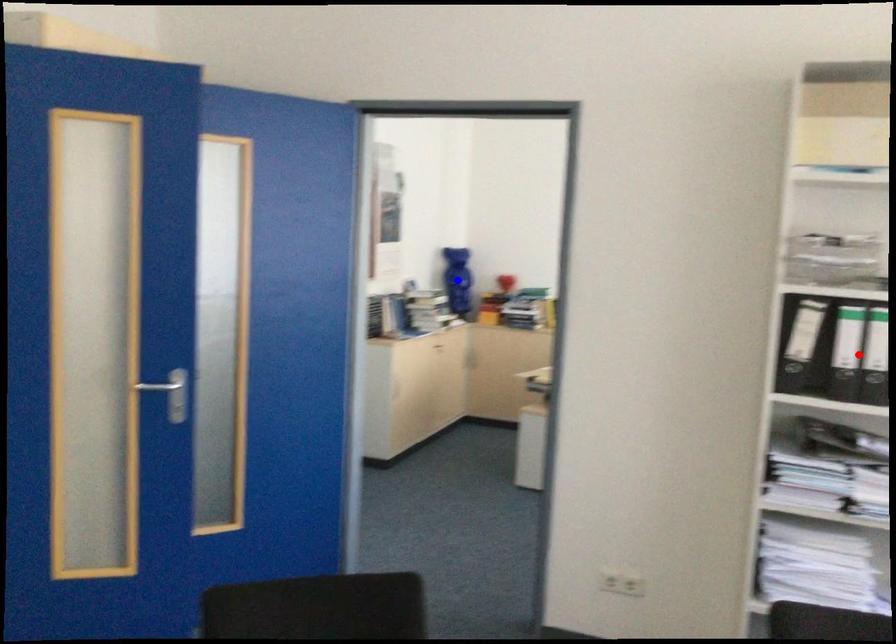
Question: In the image, two points are highlighted. Which point is nearer to the camera? Reply with the corresponding letter.

Choices:
 (A) blue point
 (B) red point

Answer: (B)